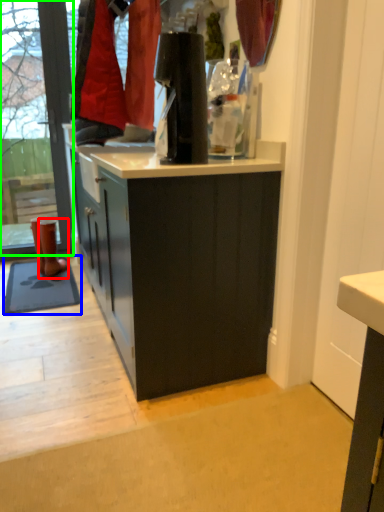
Question: Which object is the closest to the footwear (highlighted by a red box)? Choose among these: mat (highlighted by a blue box) or shop window (highlighted by a green box).

Choices:
 (A) mat
 (B) shop window

Answer: (A)